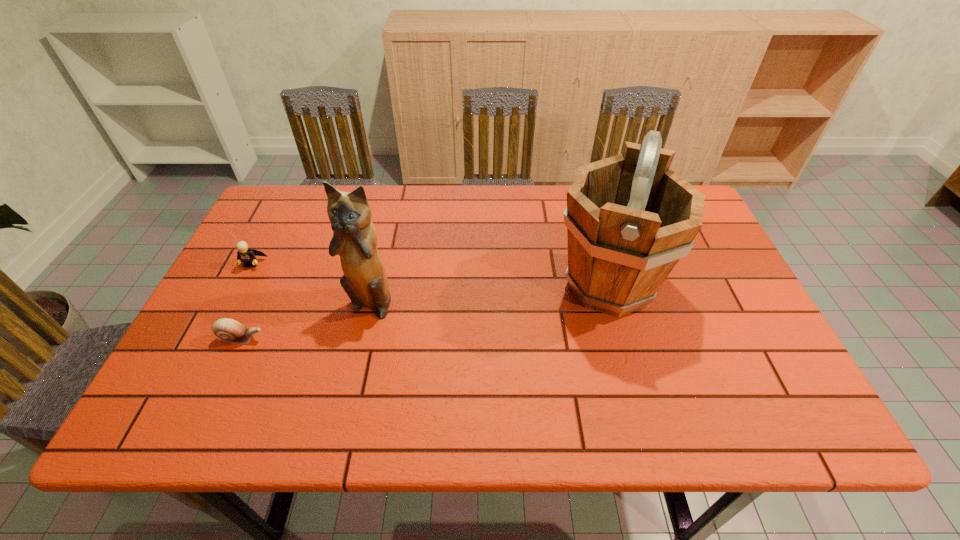
Locate an element on the screen. The width and height of the screenshot is (960, 540). the tallest object is located at coordinates (629, 218).

Find the location of a particular element. The height and width of the screenshot is (540, 960). bucket is located at coordinates (629, 218).

Where is `the second object from right to left`? The height and width of the screenshot is (540, 960). the second object from right to left is located at coordinates (354, 239).

Locate an element on the screen. This screenshot has height=540, width=960. cat is located at coordinates (354, 239).

Find the location of a particular element. the third tallest object is located at coordinates (248, 256).

I want to click on the shortest object, so (229, 330).

The height and width of the screenshot is (540, 960). In order to click on vacant space situated 0.150m on the left of the rightmost object in this screenshot , I will do `click(493, 286)`.

Where is `vacant space situated on the face of the third shortest object`? The height and width of the screenshot is (540, 960). vacant space situated on the face of the third shortest object is located at coordinates (341, 427).

Locate an element on the screen. The height and width of the screenshot is (540, 960). vacant region located on the front-facing side of the third tallest object is located at coordinates (197, 372).

The image size is (960, 540). Identify the location of free region located on the front-facing side of the escargot. (330, 339).